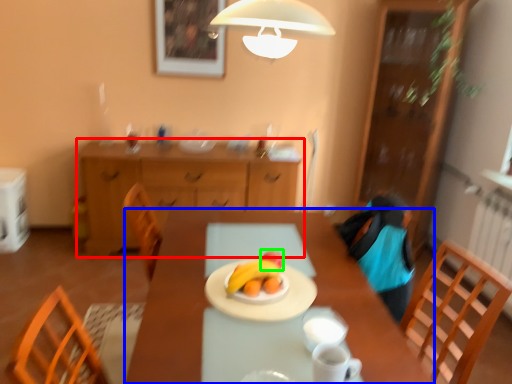
Question: Considering the real-world distances, which object is farthest from cabinetry (highlighted by a red box)? desk (highlighted by a blue box) or fruit (highlighted by a green box)?

Choices:
 (A) desk
 (B) fruit

Answer: (B)